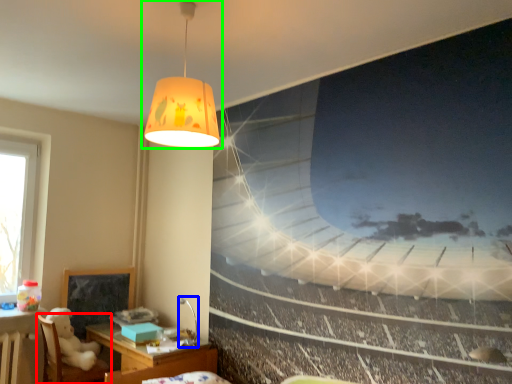
Question: Estimate the real-world distances between objects in this image. Which object is closer to furniture (highlighted by a red box), lamp (highlighted by a blue box) or lamp (highlighted by a green box)?

Choices:
 (A) lamp
 (B) lamp

Answer: (A)